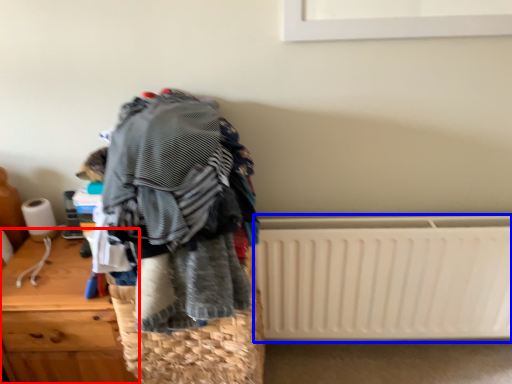
Question: Which object is further to the camera taking this photo, furniture (highlighted by a red box) or radiator (highlighted by a blue box)?

Choices:
 (A) furniture
 (B) radiator

Answer: (B)